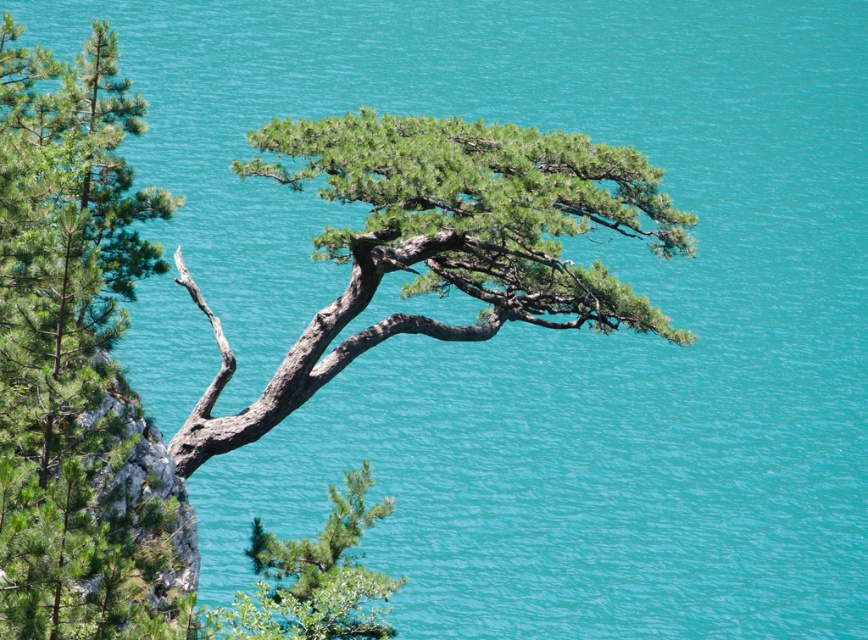
Question: Considering the relative positions of green matte tree at center and green matte tree at lower left in the image provided, where is green matte tree at center located with respect to green matte tree at lower left?

Choices:
 (A) left
 (B) right

Answer: (B)

Question: Can you confirm if green needle-like at left is positioned to the left of green matte tree at lower left?

Choices:
 (A) yes
 (B) no

Answer: (A)

Question: Based on their relative distances, which object is farther from the green matte tree at lower left?

Choices:
 (A) green needle-like at left
 (B) green matte tree at center

Answer: (B)

Question: Which object is positioned closest to the green matte tree at center?

Choices:
 (A) green needle-like at left
 (B) green matte tree at lower left

Answer: (A)

Question: Which point is farther to the camera?

Choices:
 (A) green matte tree at center
 (B) green needle-like at left

Answer: (A)

Question: Does green needle-like at left have a lesser width compared to green matte tree at center?

Choices:
 (A) no
 (B) yes

Answer: (A)